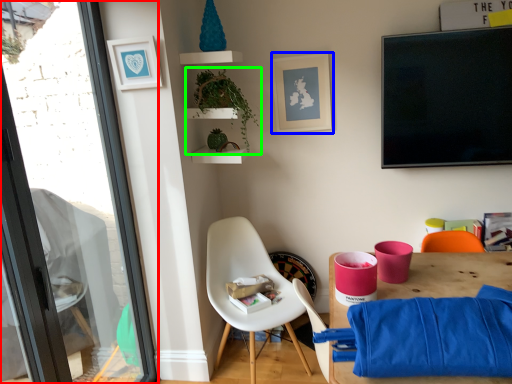
Question: Estimate the real-world distances between objects in this image. Which object is farther from window (highlighted by a red box), picture frame (highlighted by a blue box) or houseplant (highlighted by a green box)?

Choices:
 (A) picture frame
 (B) houseplant

Answer: (A)